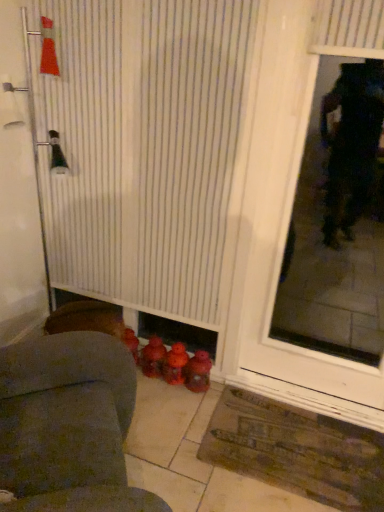
Question: Does rubberized plastic toy at lower center, arranged as the 2th toy when viewed from the right, have a greater width compared to rubberized red toy at lower center, which appears as the 3th toy when viewed from the left?

Choices:
 (A) no
 (B) yes

Answer: (A)

Question: Can you confirm if rubberized plastic toy at lower center, arranged as the 2th toy when viewed from the right, is taller than rubberized red toy at lower center, the first toy positioned from the right?

Choices:
 (A) yes
 (B) no

Answer: (A)

Question: Considering the relative positions of rubberized plastic toy at lower center, the 2th toy when ordered from left to right, and rubberized red toy at lower center, the first toy positioned from the right, in the image provided, is rubberized plastic toy at lower center, the 2th toy when ordered from left to right, to the right of rubberized red toy at lower center, the first toy positioned from the right, from the viewer's perspective?

Choices:
 (A) no
 (B) yes

Answer: (A)

Question: Could you tell me if rubberized plastic toy at lower center, the 2th toy when ordered from left to right, is facing rubberized red toy at lower center, the first toy positioned from the right?

Choices:
 (A) no
 (B) yes

Answer: (A)

Question: Is rubberized plastic toy at lower center, arranged as the 2th toy when viewed from the right, next to rubberized red toy at lower center, which appears as the 3th toy when viewed from the left?

Choices:
 (A) no
 (B) yes

Answer: (B)

Question: From a real-world perspective, relative to rubberized plastic toy at center, the 1th toy when ordered from left to right, is brown textured mat at lower right vertically above or below?

Choices:
 (A) above
 (B) below

Answer: (B)

Question: Considering their positions, is brown textured mat at lower right located in front of or behind rubberized plastic toy at center, the 1th toy when ordered from left to right?

Choices:
 (A) front
 (B) behind

Answer: (A)

Question: From the image's perspective, relative to rubberized plastic toy at center, the 1th toy when ordered from left to right, is brown textured mat at lower right above or below?

Choices:
 (A) above
 (B) below

Answer: (B)

Question: Considering the positions of brown textured mat at lower right and rubberized plastic toy at center, the 1th toy when ordered from left to right, in the image, is brown textured mat at lower right taller or shorter than rubberized plastic toy at center, the 1th toy when ordered from left to right,?

Choices:
 (A) short
 (B) tall

Answer: (A)

Question: Is velvet gray armchair at lower left situated inside white striped shower curtain at lower center or outside?

Choices:
 (A) outside
 (B) inside

Answer: (A)

Question: From the image's perspective, is velvet gray armchair at lower left above or below white striped shower curtain at lower center?

Choices:
 (A) above
 (B) below

Answer: (B)

Question: Considering the relative positions of velvet gray armchair at lower left and white striped shower curtain at lower center in the image provided, is velvet gray armchair at lower left to the left or to the right of white striped shower curtain at lower center?

Choices:
 (A) left
 (B) right

Answer: (A)

Question: In terms of width, does velvet gray armchair at lower left look wider or thinner when compared to white striped shower curtain at lower center?

Choices:
 (A) thin
 (B) wide

Answer: (B)

Question: Considering the positions of transparent glass door at right and white striped shower curtain at lower center in the image, is transparent glass door at right taller or shorter than white striped shower curtain at lower center?

Choices:
 (A) tall
 (B) short

Answer: (B)

Question: Visually, is transparent glass door at right positioned to the left or to the right of white striped shower curtain at lower center?

Choices:
 (A) left
 (B) right

Answer: (B)